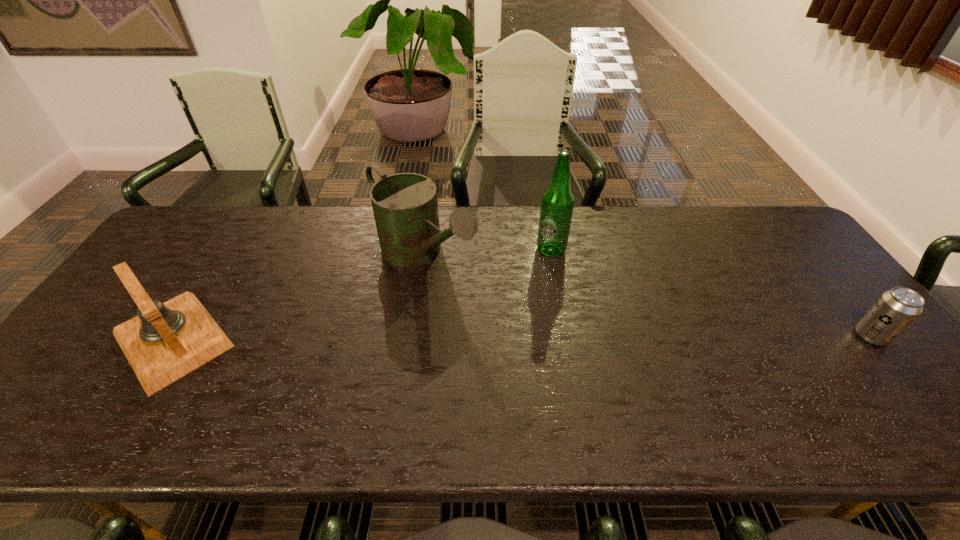
Locate an element on the screen. Image resolution: width=960 pixels, height=540 pixels. the second shortest object is located at coordinates (166, 341).

Identify the location of the leftmost object. The height and width of the screenshot is (540, 960). tap(166, 341).

I want to click on beer can, so click(x=896, y=309).

This screenshot has height=540, width=960. What are the coordinates of `the shortest object` in the screenshot? It's located at (896, 309).

Locate an element on the screen. the third object from left to right is located at coordinates (557, 202).

Find the location of a particular element. The height and width of the screenshot is (540, 960). beer bottle is located at coordinates (557, 202).

I want to click on the third shortest object, so click(405, 206).

The height and width of the screenshot is (540, 960). Identify the location of watering can. (405, 206).

This screenshot has height=540, width=960. In order to click on free location located 0.050m on the back of the leftmost object in this screenshot , I will do `click(210, 280)`.

Locate an element on the screen. free space located 0.190m on the left of the beer can is located at coordinates (780, 336).